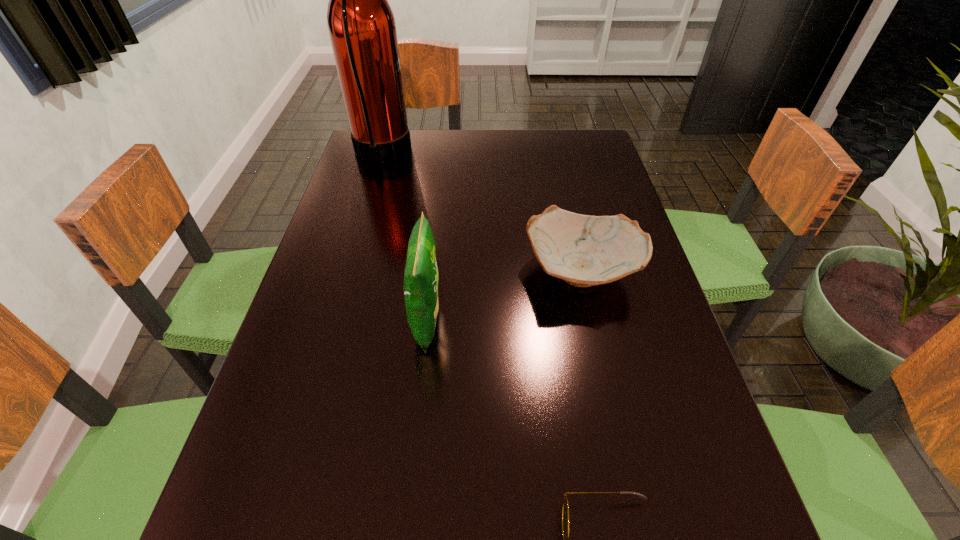
I want to click on vacant area that lies between the leftmost object and the third tallest object, so click(481, 212).

I want to click on vacant point located between the third shortest object and the third tallest object, so pyautogui.click(x=504, y=295).

In order to click on object that is the second closest to the third object from right to left in this screenshot , I will do `click(565, 509)`.

Find the location of a particular element. The image size is (960, 540). object identified as the second closest to the nearest object is located at coordinates (584, 250).

You are a GUI agent. You are given a task and a screenshot of the screen. Output one action in this format:
    pyautogui.click(x=<x>, y=<y>)
    Task: Click on the vacant space that satisfies the following two spatial constraints: 1. on the front-facing side of the pottery; 2. on the right side of the tallest object
    Image resolution: width=960 pixels, height=540 pixels.
    Given the screenshot: What is the action you would take?
    pyautogui.click(x=348, y=269)

Identify the location of free space in the image that satisfies the following two spatial constraints: 1. on the front-facing side of the leftmost object; 2. on the back side of the pottery. (348, 269).